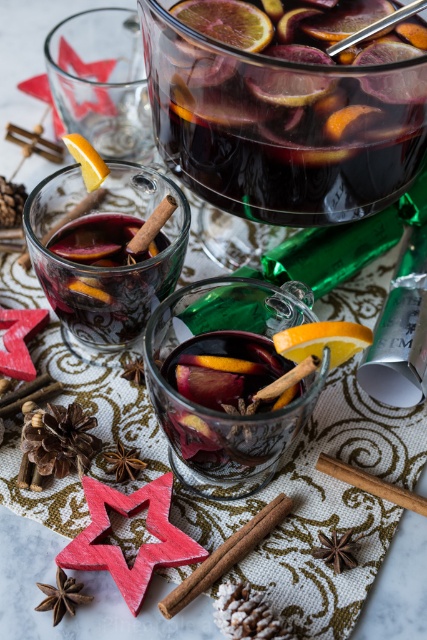
Question: Is orangesmoothslice at center to the right of yellow matte orange at center from the viewer's perspective?

Choices:
 (A) no
 (B) yes

Answer: (B)

Question: Which point is farther from the camera taking this photo?

Choices:
 (A) (360, 132)
 (B) (371, 156)

Answer: (B)

Question: Which point is closer to the camera?

Choices:
 (A) orangesmoothorange slice at upper center
 (B) orangesmoothslice at center

Answer: (B)

Question: Which of these objects is positioned closest to the orangesmoothslice at center?

Choices:
 (A) yellow matte orange at center
 (B) orangesmoothorange slice at upper center

Answer: (B)

Question: Observing the image, what is the correct spatial positioning of orangesmoothorange slice at upper center in reference to yellow matte orange at center?

Choices:
 (A) below
 (B) above

Answer: (B)

Question: Is orangesmoothslice at center bigger than orangesmoothorange slice at upper center?

Choices:
 (A) no
 (B) yes

Answer: (B)